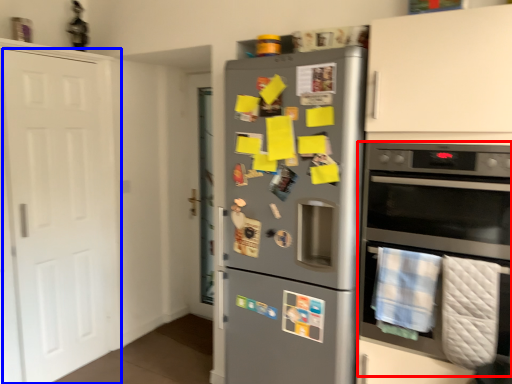
Question: Which point is closer to the camera, oven (highlighted by a red box) or door (highlighted by a blue box)?

Choices:
 (A) oven
 (B) door

Answer: (A)